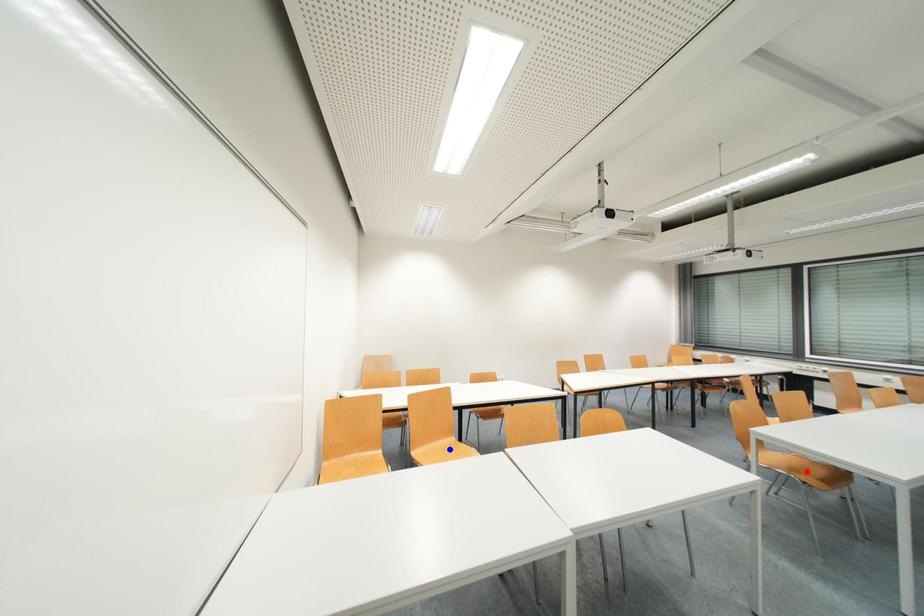
Question: Two points are marked on the image. Which point is closer to the camera?

Choices:
 (A) Blue point is closer.
 (B) Red point is closer.

Answer: (B)